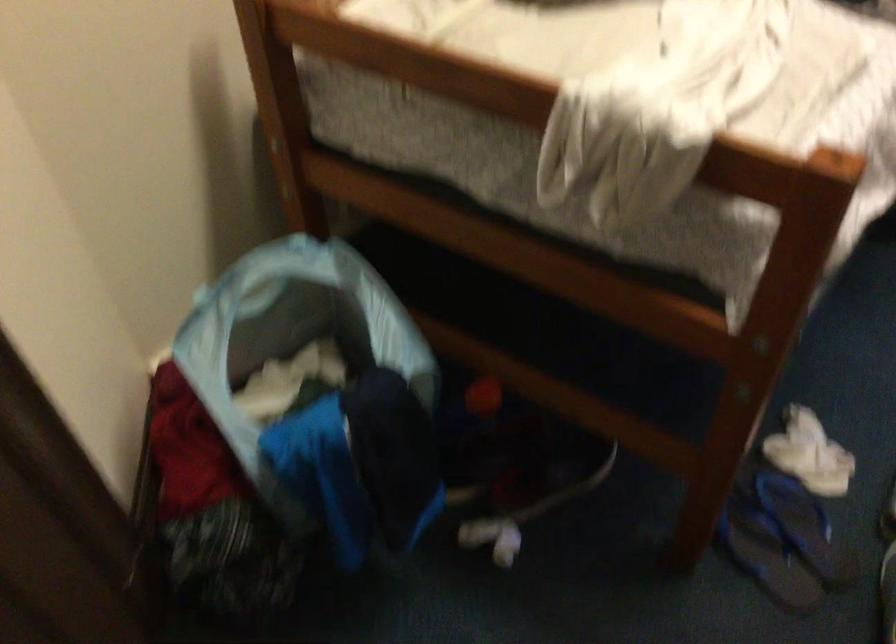
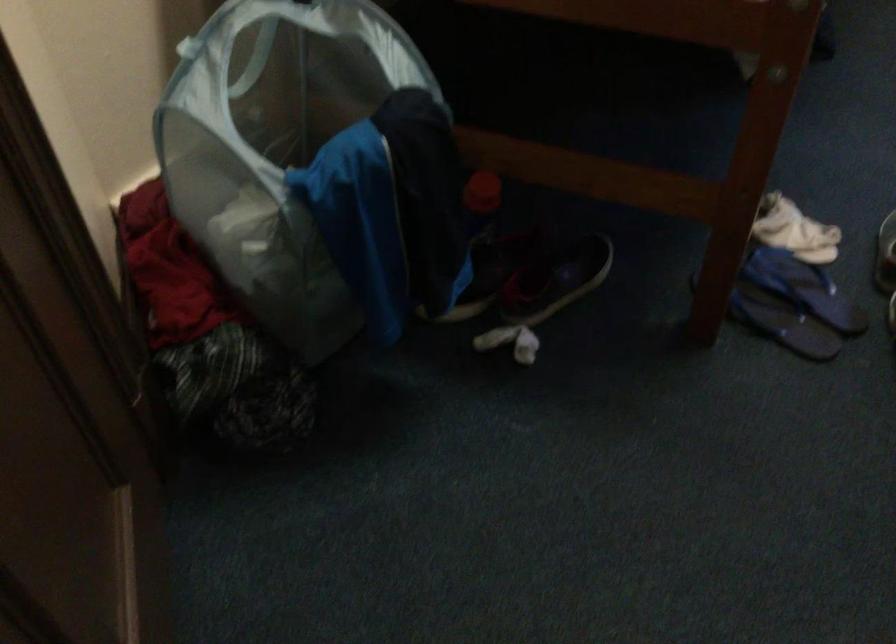
In the second image, find the point that corresponds to (202,295) in the first image.

(186, 46)